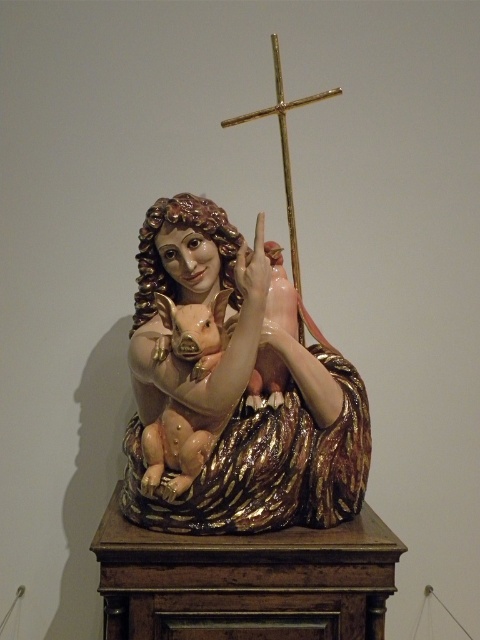
Who is positioned more to the right, glossy ceramic statue at center or gold polished cross at upper center?

gold polished cross at upper center

Is glossy ceramic statue at center above gold polished cross at upper center?

Incorrect, glossy ceramic statue at center is not positioned above gold polished cross at upper center.

Where is `glossy ceramic statue at center`? The width and height of the screenshot is (480, 640). glossy ceramic statue at center is located at coordinates (241, 388).